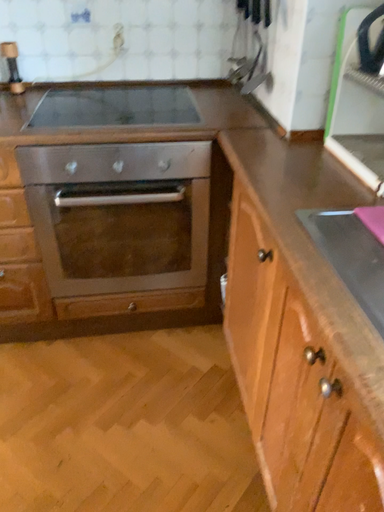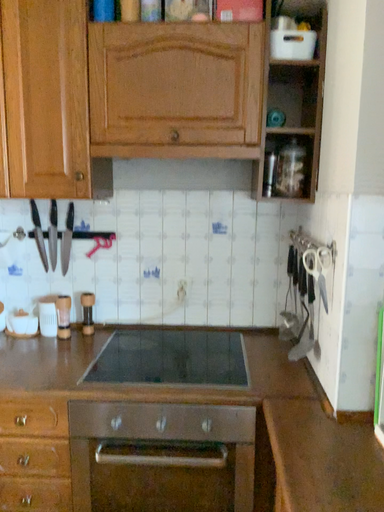
Question: Which way did the camera rotate in the video?

Choices:
 (A) rotated right
 (B) rotated left

Answer: (B)